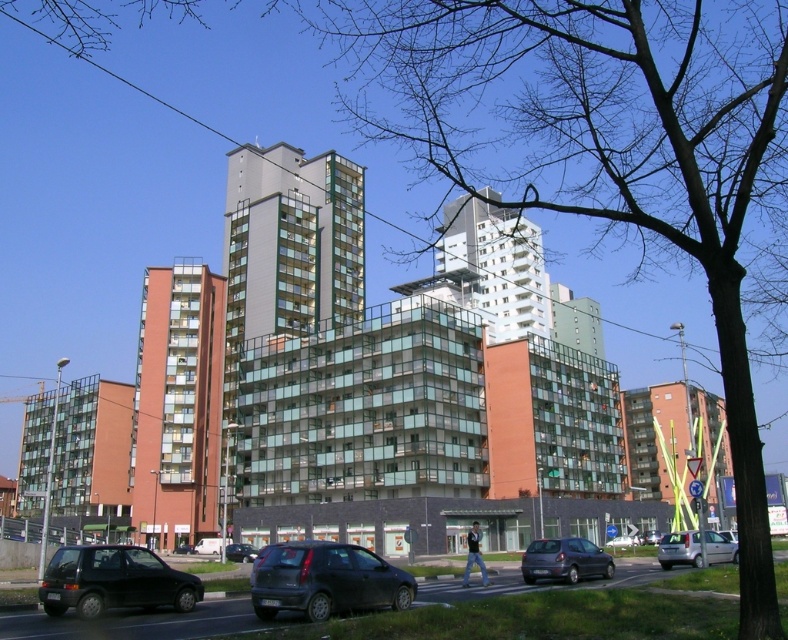
You are a delivery driver approaching the residential complex and need to park your vehicle. You see a matte black car at lower left and a dark gray metallic hatchback at lower center. Which parking spot is higher up and closer to the entrance?

The matte black car at lower left is above the dark gray metallic hatchback at lower center, so its parking spot is higher up and closer to the entrance.

You are a driver looking to park your car in the residential complex. You see the matte black car at center and the metallic silver sedan at center. Which parking spot is closer to the grassy area with trees?

The matte black car at center is located above the metallic silver sedan at center, so the metallic silver sedan at center is closer to the grassy area with trees.

You are a delivery driver who needs to park your vehicle in a spot between the matte black car at lower left and the silver metallic sedan at lower right. Given that your vehicle is 1.6 meters tall, can you safely park there without hitting the roof?

The matte black car at lower left is taller than silver metallic sedan at lower right. Since the matte black car at lower left is taller, the parking spot between them may have a height restriction based on the shorter vehicle. However, since your vehicle is 1.6 meters tall and the silver metallic sedan at lower right is shorter, if the height limit is determined by the lower of the two, your vehicle should fit. But without knowing the exact height limit, it is uncertain. However, according to the given, if